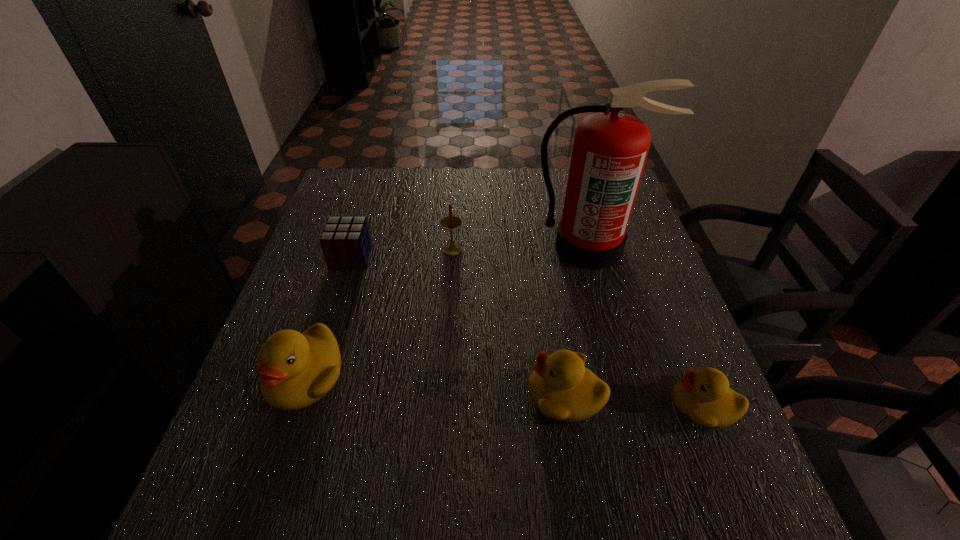
At what (x,y) coordinates should I click in order to perform the action: click on vacant point located on the front-facing side of the second duckling from right to left. Please return your answer as a coordinate pair (x, y). This screenshot has height=540, width=960. Looking at the image, I should click on (441, 395).

Locate an element on the screen. vacant space located 0.180m on the front-facing side of the shortest duckling is located at coordinates (577, 405).

Locate an element on the screen. This screenshot has width=960, height=540. free location located 0.070m on the front-facing side of the shortest duckling is located at coordinates (635, 405).

At what (x,y) coordinates should I click in order to perform the action: click on blank space located 0.170m on the front-facing side of the shortest duckling. Please return your answer as a coordinate pair (x, y). This screenshot has width=960, height=540. Looking at the image, I should click on (583, 405).

Identify the location of free space located 0.120m at the nozzle of the fire extinguisher. This screenshot has height=540, width=960. (605, 305).

Find the location of `vacant space located 0.140m on the back of the cube`. vacant space located 0.140m on the back of the cube is located at coordinates (365, 214).

Where is `free space located 0.360m on the back of the candle`? This screenshot has height=540, width=960. free space located 0.360m on the back of the candle is located at coordinates (458, 171).

Locate an element on the screen. This screenshot has height=540, width=960. duckling positioned at the left edge is located at coordinates (296, 369).

This screenshot has height=540, width=960. What are the coordinates of `cube present at the left edge` in the screenshot? It's located at (345, 241).

Where is `duckling that is at the right edge`? duckling that is at the right edge is located at coordinates (703, 397).